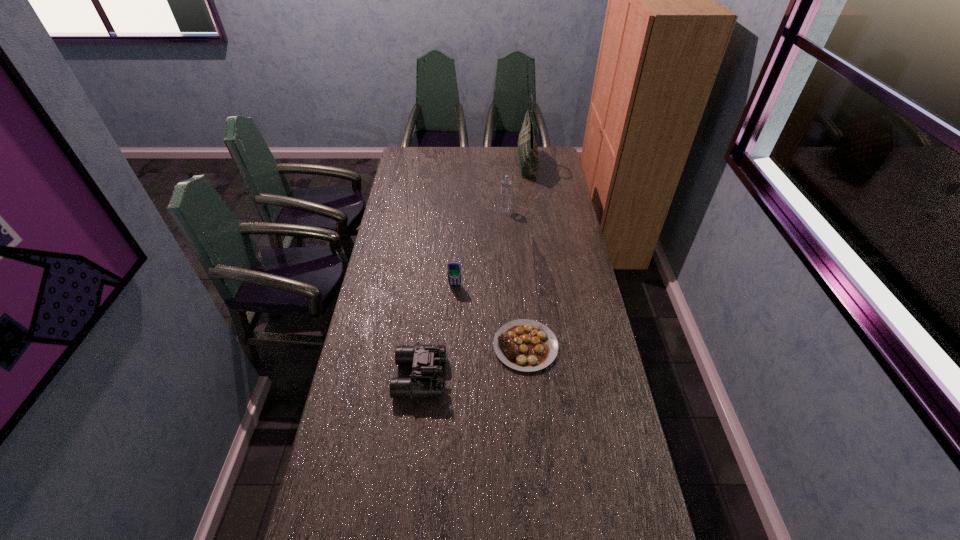
Image resolution: width=960 pixels, height=540 pixels. I want to click on vacant space that satisfies the following two spatial constraints: 1. on the front-facing side of the cellular telephone; 2. through the lenses of the binoculars, so [x=450, y=377].

The image size is (960, 540). I want to click on free space in the image that satisfies the following two spatial constraints: 1. on the front-facing side of the shortest object; 2. on the left side of the cellular telephone, so click(452, 346).